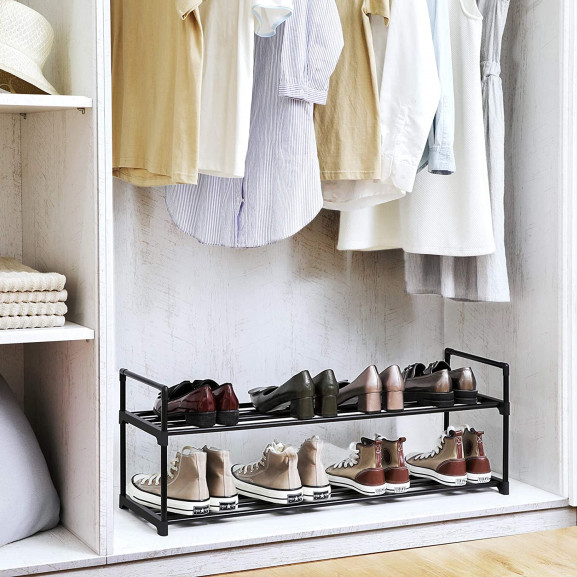
You are a GUI agent. You are given a task and a screenshot of the screen. Output one action in this format:
    pyautogui.click(x=<x>, y=<y>)
    Task: Click on the garment suspended by hanger
    This screenshot has height=577, width=577.
    Given the screenshot: What is the action you would take?
    pyautogui.click(x=494, y=27), pyautogui.click(x=464, y=26), pyautogui.click(x=442, y=24), pyautogui.click(x=403, y=26), pyautogui.click(x=355, y=27), pyautogui.click(x=313, y=31), pyautogui.click(x=227, y=29), pyautogui.click(x=168, y=50)